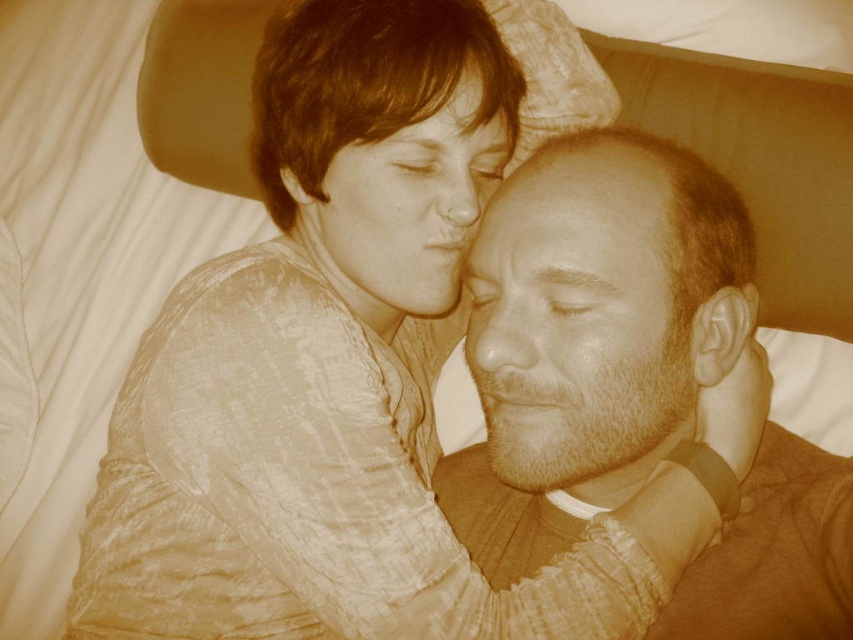
You are a photographer analyzing the composition of this image. You notice the beige textured skin at center and the smooth skin face at upper center. Which object is positioned lower in the frame?

The beige textured skin at center is positioned below the smooth skin face at upper center, so the beige textured skin at center is lower in the frame.

You are a photographer taking a portrait of two people in a warm, nostalgic setting. You need to ensure that the beige textured skin at center and the smooth skin face at upper center are within a 5 inch distance for proper lighting. Can you confirm if they are within the required distance?

The beige textured skin at center is 5.12 inches from the smooth skin face at upper center, which exceeds the 5 inch requirement. Therefore, they are slightly too far apart for the proper lighting distance.